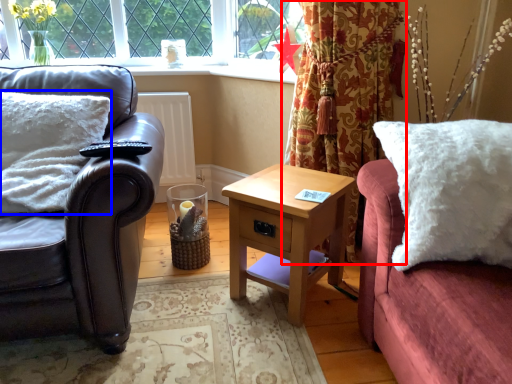
Question: Among these objects, which one is farthest to the camera, curtain (highlighted by a red box) or pillow (highlighted by a blue box)?

Choices:
 (A) curtain
 (B) pillow

Answer: (A)